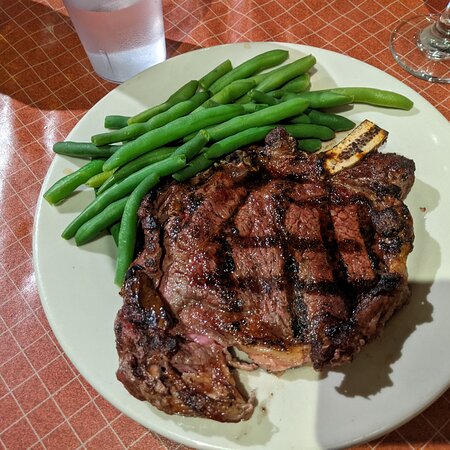
Locate an element on the screen. cup of water is located at coordinates (151, 20).